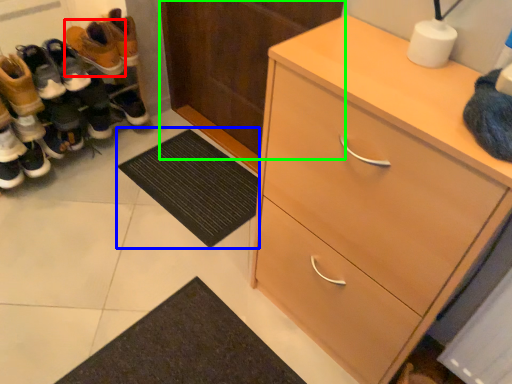
Question: Which object is the closest to the footwear (highlighted by a red box)? Choose among these: doormat (highlighted by a blue box) or door (highlighted by a green box).

Choices:
 (A) doormat
 (B) door

Answer: (B)